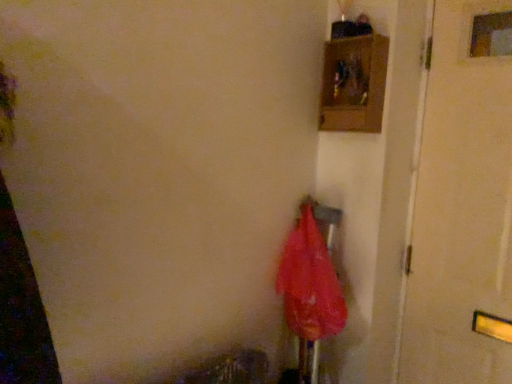
The height and width of the screenshot is (384, 512). Identify the location of translucent red umbrella at center. (311, 288).

Measure the distance between point (x=308, y=308) and camera.

Point (x=308, y=308) and camera are 1.48 meters apart.

The height and width of the screenshot is (384, 512). Describe the element at coordinates (311, 288) in the screenshot. I see `translucent red umbrella at center` at that location.

The width and height of the screenshot is (512, 384). What do you see at coordinates (460, 210) in the screenshot?
I see `white matte door at right` at bounding box center [460, 210].

You are a GUI agent. You are given a task and a screenshot of the screen. Output one action in this format:
    pyautogui.click(x=<x>, y=<y>)
    Task: Click on the white matte door at right
    Image resolution: width=512 pixels, height=384 pixels.
    Given the screenshot: What is the action you would take?
    pyautogui.click(x=460, y=210)

Consider the image. What is the approximate width of white matte door at right?

The width of white matte door at right is 4.56 inches.

Image resolution: width=512 pixels, height=384 pixels. What are the coordinates of `translucent red umbrella at center` in the screenshot? It's located at (311, 288).

Considering the positions of objects white matte door at right and translucent red umbrella at center in the image provided, who is more to the right, white matte door at right or translucent red umbrella at center?

Positioned to the right is white matte door at right.

Is white matte door at right further to camera compared to translucent red umbrella at center?

No, it is in front of translucent red umbrella at center.

Considering the positions of points (459, 283) and (305, 366), is point (459, 283) farther from camera compared to point (305, 366)?

No.

From the image's perspective, which one is positioned higher, white matte door at right or translucent red umbrella at center?

white matte door at right appears higher in the image.

From a real-world perspective, is white matte door at right over translucent red umbrella at center?

Yes, from a real-world perspective, white matte door at right is above translucent red umbrella at center.

In the scene shown: Is white matte door at right wider than translucent red umbrella at center?

No, white matte door at right is not wider than translucent red umbrella at center.

Is white matte door at right taller or shorter than translucent red umbrella at center?

Clearly, white matte door at right is taller compared to translucent red umbrella at center.

Which of these two, white matte door at right or translucent red umbrella at center, is smaller?

With smaller size is translucent red umbrella at center.

From the picture: Is white matte door at right inside the boundaries of translucent red umbrella at center, or outside?

The correct answer is: outside.

Can you see white matte door at right touching translucent red umbrella at center?

They are not placed beside each other.

Could you tell me if white matte door at right is facing translucent red umbrella at center?

No, white matte door at right is not oriented towards translucent red umbrella at center.

You are a GUI agent. You are given a task and a screenshot of the screen. Output one action in this format:
    pyautogui.click(x=<x>, y=<y>)
    Task: Click on the umbrella located underneath the white matte door at right (from a real-world perspective)
    The height and width of the screenshot is (384, 512).
    Given the screenshot: What is the action you would take?
    pyautogui.click(x=311, y=288)

Looking at this image, is translucent red umbrella at center to the right of white matte door at right from the viewer's perspective?

No.

Which object is closer to the camera, translucent red umbrella at center or white matte door at right?

white matte door at right.

Is point (292, 371) positioned behind point (495, 91)?

Yes, it is.

From the image's perspective, is translucent red umbrella at center below white matte door at right?

Indeed, from the image's perspective, translucent red umbrella at center is shown beneath white matte door at right.

In the scene shown: From a real-world perspective, which object rests below the other?

translucent red umbrella at center.

Is translucent red umbrella at center wider than white matte door at right?

Yes, translucent red umbrella at center is wider than white matte door at right.

From the picture: Does translucent red umbrella at center have a lesser height compared to white matte door at right?

Yes, translucent red umbrella at center is shorter than white matte door at right.

Which of these two, translucent red umbrella at center or white matte door at right, is smaller?

With smaller size is translucent red umbrella at center.

Is translucent red umbrella at center completely or partially outside of white matte door at right?

That's correct, translucent red umbrella at center is outside of white matte door at right.

Are translucent red umbrella at center and white matte door at right located far from each other?

No, there isn't a large distance between translucent red umbrella at center and white matte door at right.

Does translucent red umbrella at center turn towards white matte door at right?

No, translucent red umbrella at center is not oriented towards white matte door at right.

How many degrees apart are the facing directions of translucent red umbrella at center and white matte door at right?

The angular difference between translucent red umbrella at center and white matte door at right is 91.8 degrees.

Identify the location of door above the translucent red umbrella at center (from the image's perspective). Image resolution: width=512 pixels, height=384 pixels. (460, 210).

This screenshot has height=384, width=512. Identify the location of door in front of the translucent red umbrella at center. (460, 210).

You are a GUI agent. You are given a task and a screenshot of the screen. Output one action in this format:
    pyautogui.click(x=<x>, y=<y>)
    Task: Click on the umbrella below the white matte door at right (from a real-world perspective)
    The height and width of the screenshot is (384, 512).
    Given the screenshot: What is the action you would take?
    pyautogui.click(x=311, y=288)